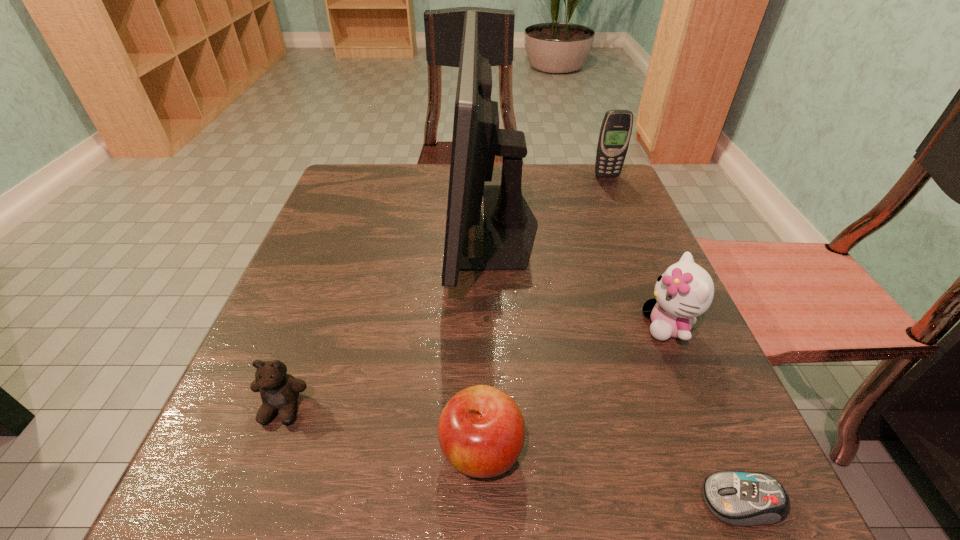
I want to click on free location that satisfies the following two spatial constraints: 1. on the screen of the fifth shortest object; 2. on the front-facing side of the fourth shortest object, so click(670, 326).